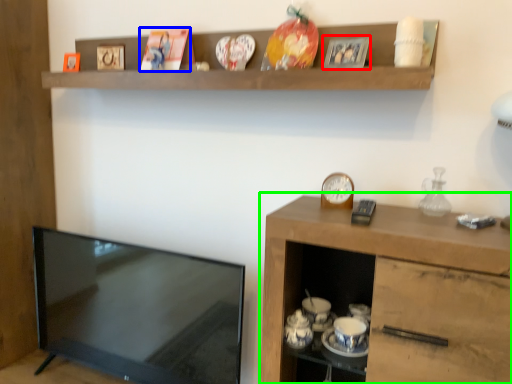
Question: Which object is positioned closest to picture frame (highlighted by a red box)? Select from picture frame (highlighted by a blue box) and cabinetry (highlighted by a green box).

Choices:
 (A) picture frame
 (B) cabinetry

Answer: (A)